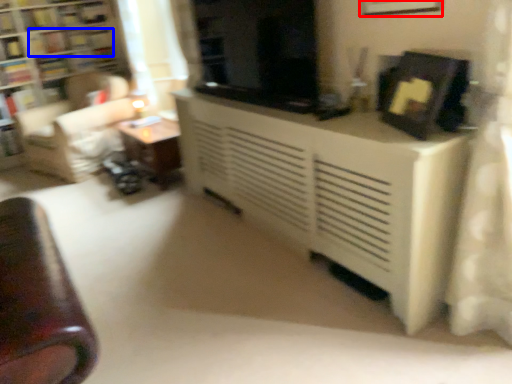
Question: Which object is further to the camera taking this photo, picture frame (highlighted by a red box) or book (highlighted by a blue box)?

Choices:
 (A) picture frame
 (B) book

Answer: (B)